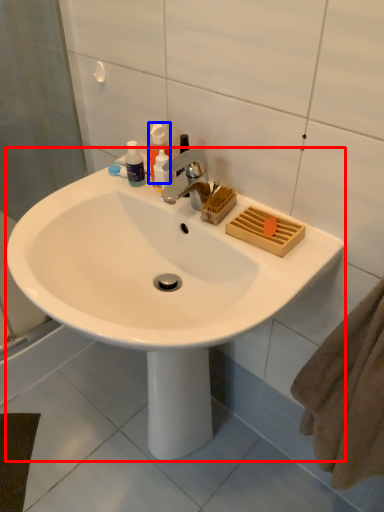
Question: Which of the following is the farthest to the observer, sink (highlighted by a red box) or soap dispenser (highlighted by a blue box)?

Choices:
 (A) sink
 (B) soap dispenser

Answer: (B)